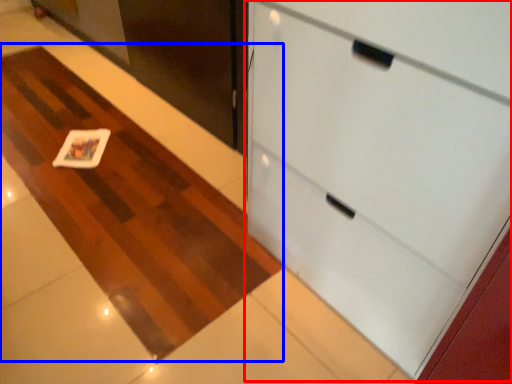
Question: Which object is further to the camera taking this photo, cabinetry (highlighted by a red box) or plain (highlighted by a blue box)?

Choices:
 (A) cabinetry
 (B) plain

Answer: (B)